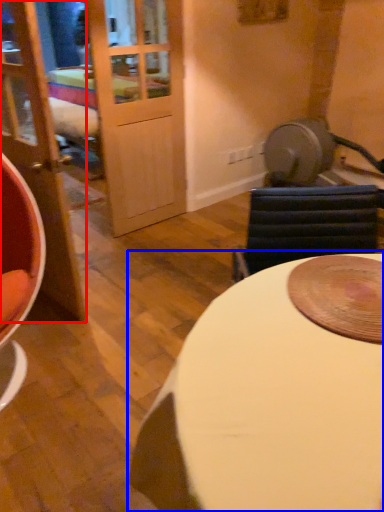
Question: Which object appears closest to the camera in this image, door (highlighted by a red box) or table (highlighted by a blue box)?

Choices:
 (A) door
 (B) table

Answer: (B)